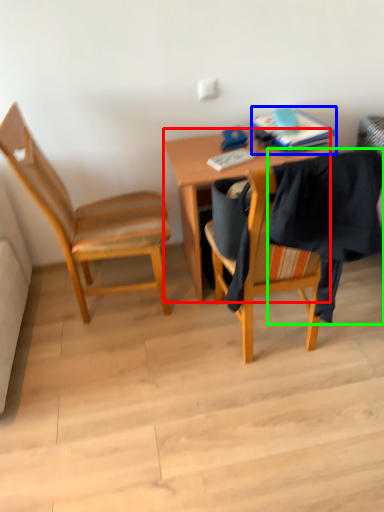
Question: Based on their relative distances, which object is nearer to desk (highlighted by a red box)? Choose from book (highlighted by a blue box) and clothe (highlighted by a green box).

Choices:
 (A) book
 (B) clothe

Answer: (A)